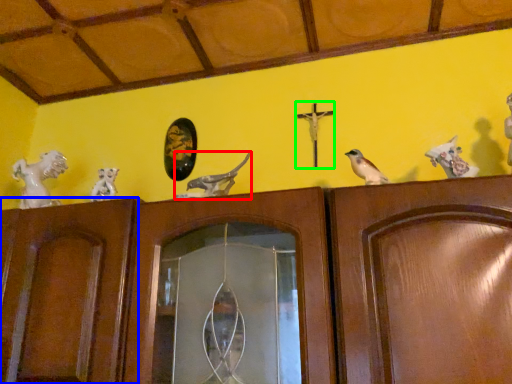
Question: Which object is the farthest from animal (highlighted by a red box)? Choose among these: door (highlighted by a blue box) or crucifix (highlighted by a green box).

Choices:
 (A) door
 (B) crucifix

Answer: (A)